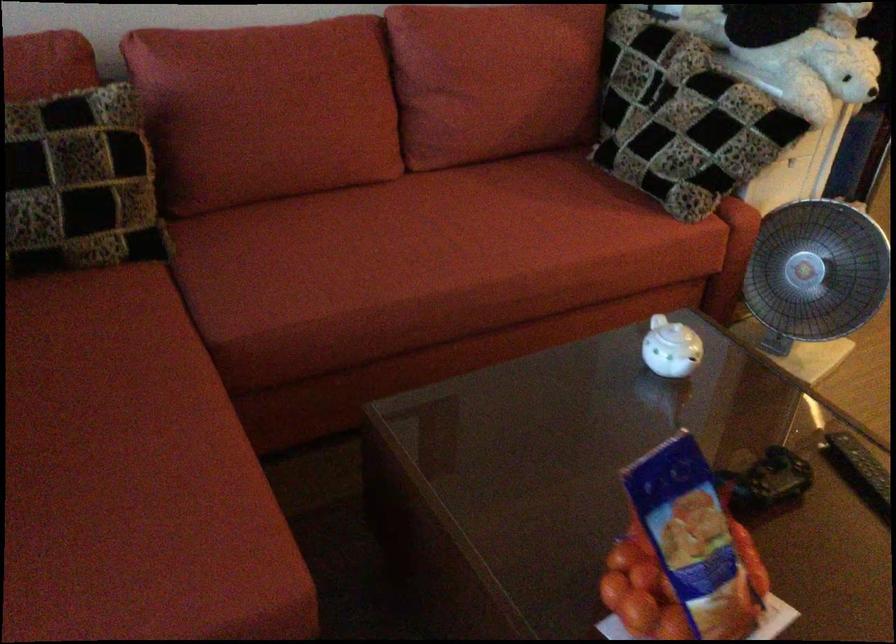
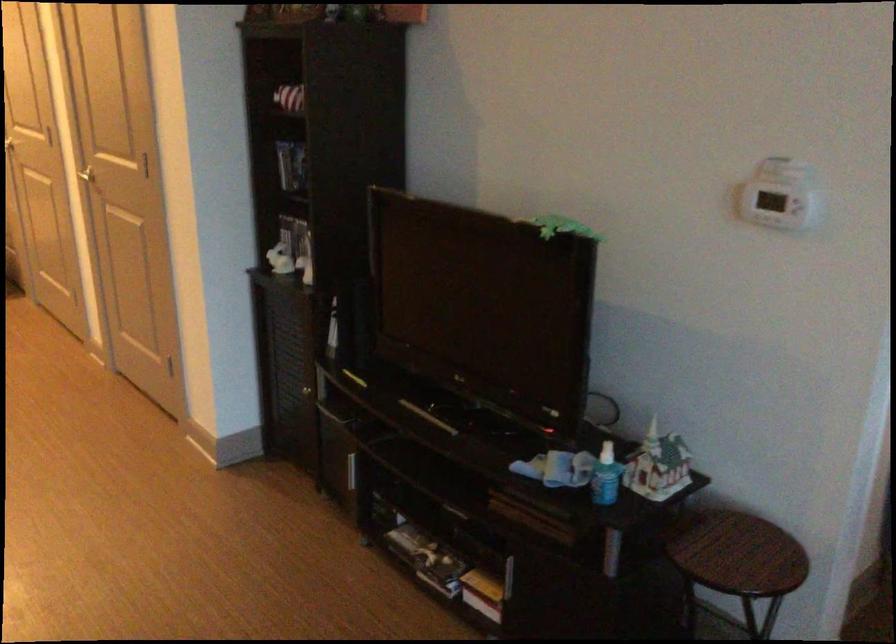
Consider the image. The first image is from the beginning of the video and the second image is from the end. How did the camera likely rotate when shooting the video?

The camera's rotation is toward right-down.